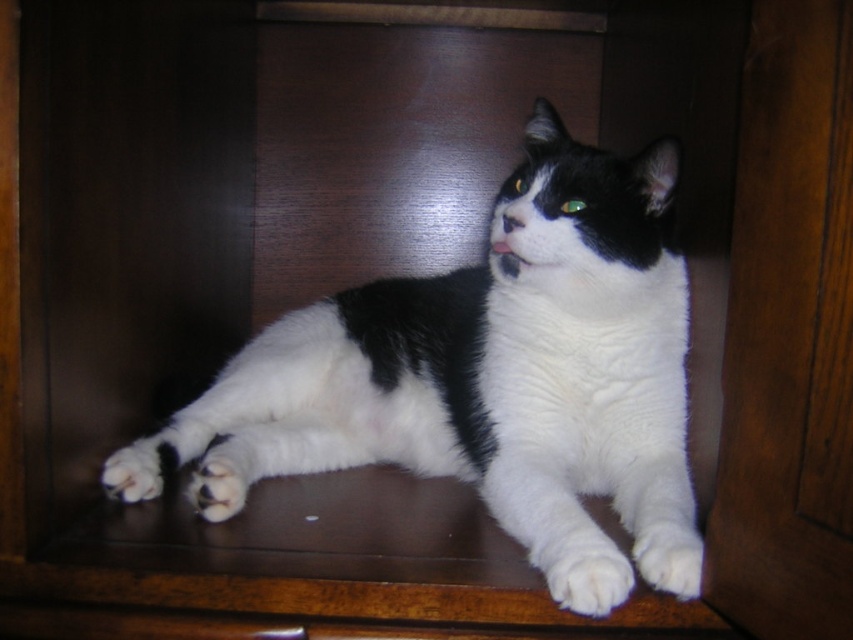
You are an animal photographer trying to capture the white fluffy paw at lower center of a cat in a wooden cabinet. Based on the coordinates provided, where should you position your camera to ensure the paw is centered in your shot?

The white fluffy paw at lower center is located at point (585, 572), so you should position your camera to center the shot at those coordinates to capture it.

You are a photographer trying to capture the cat in the wooden cabinet. You notice the white fluffy paw at lower center and the white fur at lower right. Which one is positioned more to the left side of the image?

The white fluffy paw at lower center is positioned more to the left side of the image than the white fur at lower right.

You are an animal caretaker who needs to locate the black and white fur cat at center in a wooden cabinet. According to the coordinates given, where exactly is the cat positioned?

The black and white fur cat at center is located at coordinates point (492, 356).